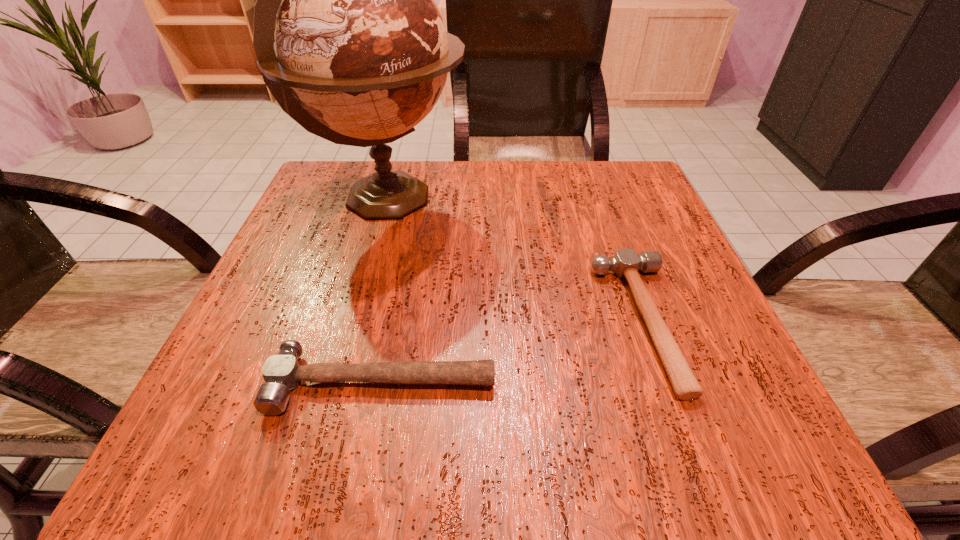
Where is `unoccupied position between the left hammer and the rightmost object`? The width and height of the screenshot is (960, 540). unoccupied position between the left hammer and the rightmost object is located at coordinates (512, 352).

Locate which object is the second closest to the rightmost object. Please provide its 2D coordinates. Your answer should be formatted as a tuple, i.e. [(x, y)], where the tuple contains the x and y coordinates of a point satisfying the conditions above.

[(363, 54)]

Locate which object is the closest to the rightmost object. Please provide its 2D coordinates. Your answer should be formatted as a tuple, i.e. [(x, y)], where the tuple contains the x and y coordinates of a point satisfying the conditions above.

[(282, 372)]

At what (x,y) coordinates should I click in order to perform the action: click on vacant space that satisfies the following two spatial constraints: 1. on the front of the farthest object showing Asia; 2. on the right side of the rightmost object. Please return your answer as a coordinate pair (x, y). Image resolution: width=960 pixels, height=540 pixels. Looking at the image, I should click on (354, 322).

Identify the location of free space in the image that satisfies the following two spatial constraints: 1. on the front of the farthest object showing Asia; 2. on the right side of the right hammer. The width and height of the screenshot is (960, 540). (354, 322).

Locate an element on the screen. The width and height of the screenshot is (960, 540). vacant area in the image that satisfies the following two spatial constraints: 1. on the front of the globe showing Asia; 2. on the back side of the rightmost object is located at coordinates (354, 322).

I want to click on free space in the image that satisfies the following two spatial constraints: 1. on the back side of the rightmost object; 2. on the front of the tallest object showing Asia, so click(598, 199).

Where is `free spot that satisfies the following two spatial constraints: 1. on the front of the right hammer showing Asia; 2. on the left side of the farthest object`? free spot that satisfies the following two spatial constraints: 1. on the front of the right hammer showing Asia; 2. on the left side of the farthest object is located at coordinates (354, 322).

Find the location of a particular element. free spot that satisfies the following two spatial constraints: 1. on the back side of the rightmost object; 2. on the front of the farthest object showing Asia is located at coordinates (598, 199).